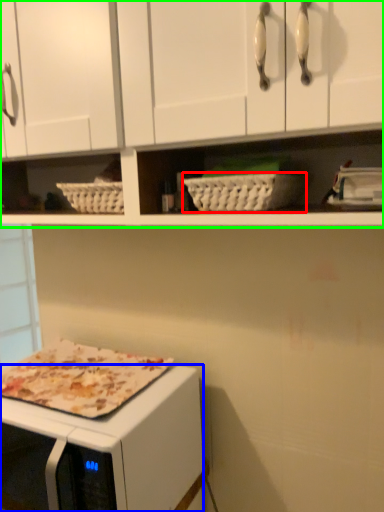
Question: Estimate the real-world distances between objects in this image. Which object is farther from basket (highlighted by a red box), microwave oven (highlighted by a blue box) or cabinetry (highlighted by a green box)?

Choices:
 (A) microwave oven
 (B) cabinetry

Answer: (A)